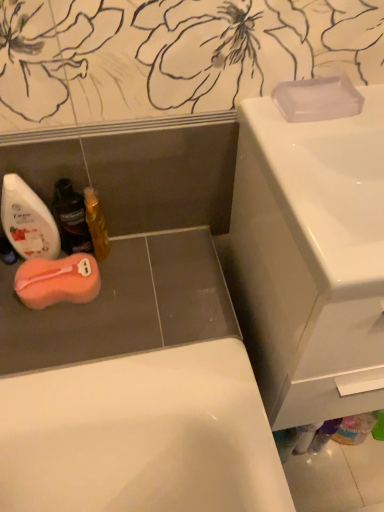
Question: Does white glossy sink at upper right have a lesser height compared to pink sponge at lower left, which is the first soap from bottom to top?

Choices:
 (A) yes
 (B) no

Answer: (B)

Question: Can you confirm if white glossy sink at upper right is bigger than pink sponge at lower left, which ranks as the second soap in right-to-left order?

Choices:
 (A) yes
 (B) no

Answer: (A)

Question: From the image's perspective, would you say white glossy sink at upper right is positioned over pink sponge at lower left, which is counted as the first soap, starting from the back?

Choices:
 (A) no
 (B) yes

Answer: (B)

Question: Is white glossy sink at upper right to the right of pink sponge at lower left, which is counted as the first soap, starting from the back, from the viewer's perspective?

Choices:
 (A) no
 (B) yes

Answer: (B)

Question: From a real-world perspective, is white glossy sink at upper right on top of pink sponge at lower left, which is counted as the first soap, starting from the back?

Choices:
 (A) yes
 (B) no

Answer: (A)

Question: From a real-world perspective, is white glossy sink at upper right above or below pink sponge at lower left, positioned as the 2th soap in top-to-bottom order?

Choices:
 (A) above
 (B) below

Answer: (A)

Question: From the image's perspective, is white glossy sink at upper right positioned above or below pink sponge at lower left, which ranks as the second soap in right-to-left order?

Choices:
 (A) above
 (B) below

Answer: (A)

Question: Considering the positions of point (266, 410) and point (82, 276), is point (266, 410) closer or farther from the camera than point (82, 276)?

Choices:
 (A) closer
 (B) farther

Answer: (B)

Question: In terms of width, does white glossy sink at upper right look wider or thinner when compared to pink sponge at lower left, the 2th soap viewed from the front?

Choices:
 (A) thin
 (B) wide

Answer: (B)

Question: Is white glossy sink at upper right inside the boundaries of translucent plastic mouthwash at lower left, arranged as the second mouthwash when viewed from the left, or outside?

Choices:
 (A) outside
 (B) inside

Answer: (A)

Question: Does point (349, 144) appear closer or farther from the camera than point (64, 241)?

Choices:
 (A) closer
 (B) farther

Answer: (A)

Question: Based on their positions, is white glossy sink at upper right located to the left or right of translucent plastic mouthwash at lower left, the 2th mouthwash positioned from the right?

Choices:
 (A) left
 (B) right

Answer: (B)

Question: Looking at the image, does white glossy sink at upper right seem bigger or smaller compared to translucent plastic mouthwash at lower left, the 2th mouthwash positioned from the right?

Choices:
 (A) big
 (B) small

Answer: (A)

Question: In the image, is shiny gold bottle at lower left, the 1th mouthwash in the right-to-left sequence, on the left side or the right side of white glossy sink at upper right?

Choices:
 (A) left
 (B) right

Answer: (A)

Question: From a real-world perspective, is shiny gold bottle at lower left, marked as the third mouthwash in a left-to-right arrangement, above or below white glossy sink at upper right?

Choices:
 (A) above
 (B) below

Answer: (A)